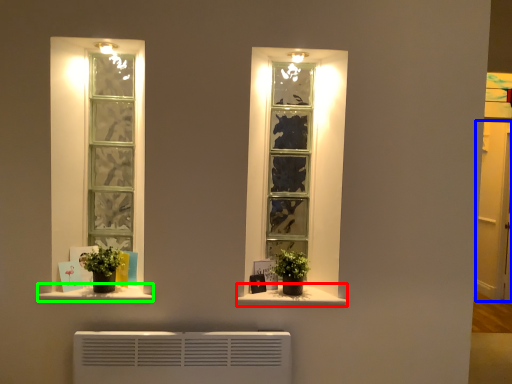
Question: Considering the real-world distances, which object is farthest from window sill (highlighted by a red box)? glass door (highlighted by a blue box) or window sill (highlighted by a green box)?

Choices:
 (A) glass door
 (B) window sill

Answer: (A)